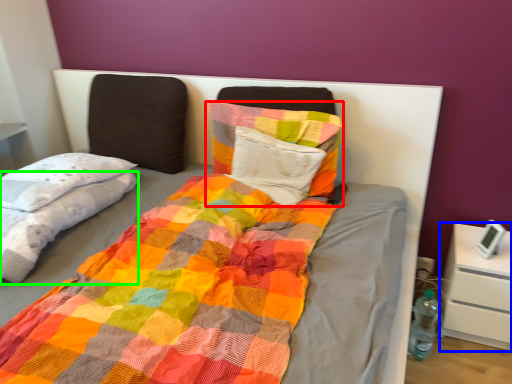
Question: Based on their relative distances, which object is farther from pillow (highlighted by a red box)? Choose from nightstand (highlighted by a blue box) and blanket (highlighted by a green box).

Choices:
 (A) nightstand
 (B) blanket

Answer: (A)